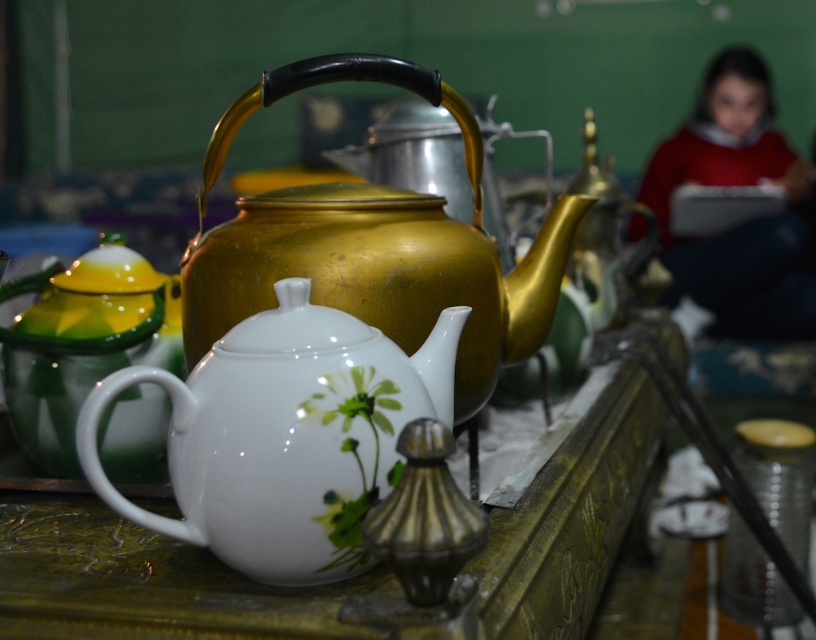
Is green glossy teapot at left behind red sweater at upper right?

No, green glossy teapot at left is closer to the viewer.

Does green glossy teapot at left have a larger size compared to red sweater at upper right?

No, green glossy teapot at left is not bigger than red sweater at upper right.

Measure the distance between green glossy teapot at left and camera.

green glossy teapot at left is 30.85 inches away from camera.

Where is `green glossy teapot at left`? green glossy teapot at left is located at coordinates (82, 342).

From the picture: Is white glossy teapot at center positioned before red sweater at upper right?

Yes.

How far apart are white glossy teapot at center and red sweater at upper right?

white glossy teapot at center is 6.48 feet away from red sweater at upper right.

At what (x,y) coordinates should I click in order to perform the action: click on white glossy teapot at center. Please return your answer as a coordinate pair (x, y). The width and height of the screenshot is (816, 640). Looking at the image, I should click on (285, 435).

Can you confirm if white glossy teapot at center is thinner than green glossy teapot at left?

No.

Is point (400, 417) positioned behind point (154, 472)?

That is False.

Between point (96, 406) and point (176, 324), which one is positioned in front?

Point (96, 406) is in front.

You are a GUI agent. You are given a task and a screenshot of the screen. Output one action in this format:
    pyautogui.click(x=<x>, y=<y>)
    Task: Click on the white glossy teapot at center
    Image resolution: width=816 pixels, height=640 pixels.
    Given the screenshot: What is the action you would take?
    pyautogui.click(x=285, y=435)